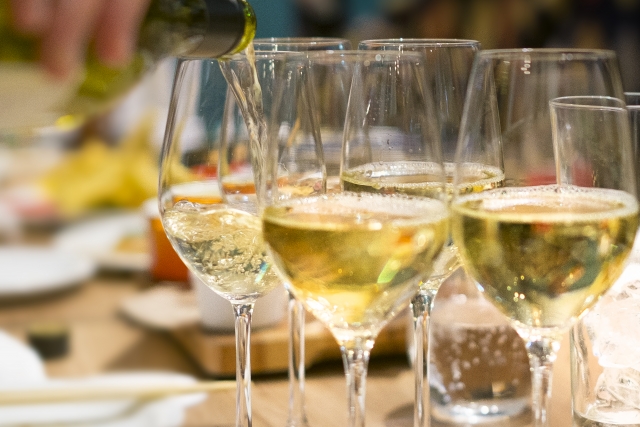
Locate an element on the screen. The image size is (640, 427). wine glasses filled with white fine is located at coordinates (538, 365), (422, 315), (353, 410), (292, 333), (246, 341).